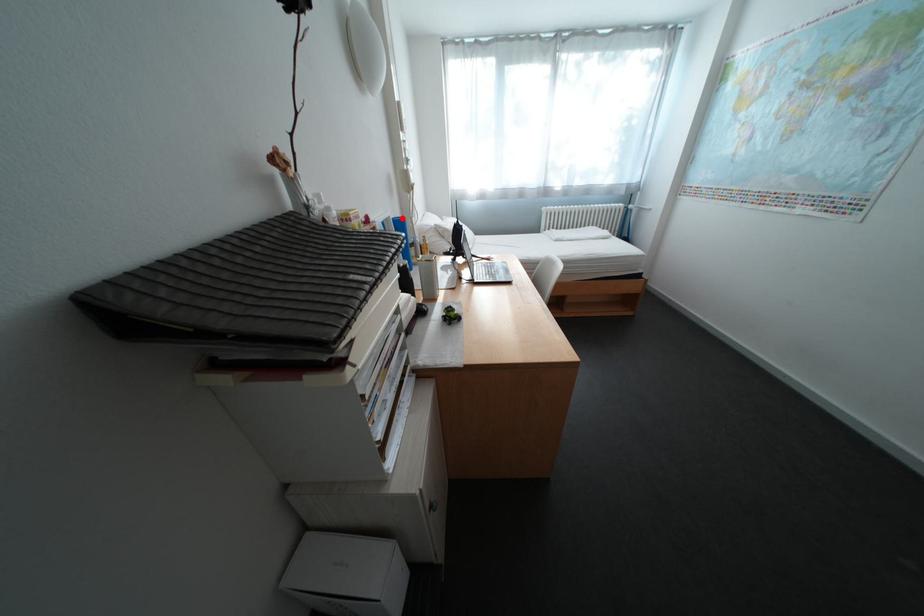
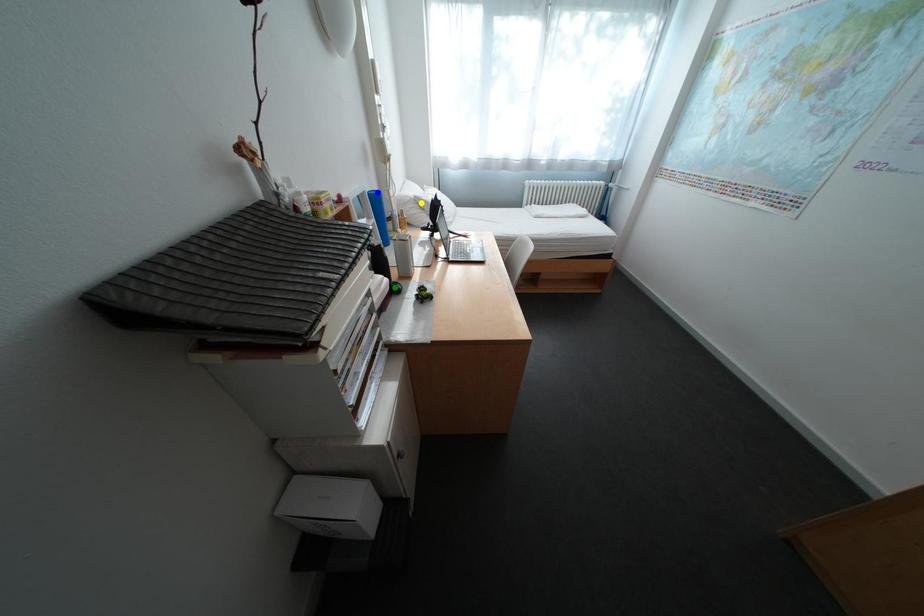
Question: I am providing you with two images of the same scene from different viewpoints. A red point is marked on the first image. You are given multiple points on the second image. Can you choose the point in image 2 that corresponds to the point in image 1?

Choices:
 (A) yellow point
 (B) blue point
 (C) green point

Answer: (B)